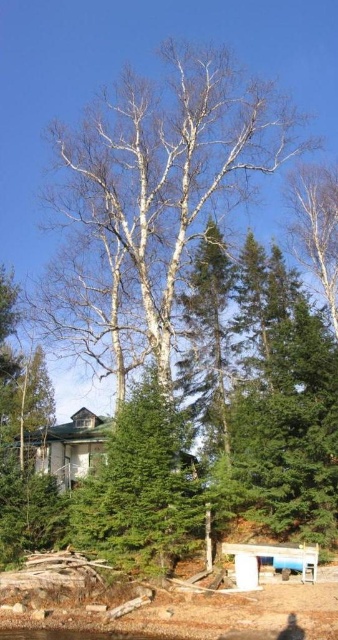
Question: Which object is closer to the camera taking this photo?

Choices:
 (A) green matte evergreen tree at center
 (B) wooden park bench at lower center

Answer: (B)

Question: Estimate the real-world distances between objects in this image. Which object is closer to the wooden park bench at lower center?

Choices:
 (A) white smooth birch tree at center
 (B) green matte evergreen tree at center

Answer: (B)

Question: Does green matte evergreen tree at center appear on the left side of wooden park bench at lower center?

Choices:
 (A) no
 (B) yes

Answer: (B)

Question: Where is white smooth birch tree at center located in relation to green matte evergreen tree at center in the image?

Choices:
 (A) below
 (B) above

Answer: (B)

Question: Which point appears farthest from the camera in this image?

Choices:
 (A) (161, 550)
 (B) (304, 563)

Answer: (A)

Question: Can you confirm if white smooth birch tree at center is thinner than green matte evergreen tree at center?

Choices:
 (A) no
 (B) yes

Answer: (A)